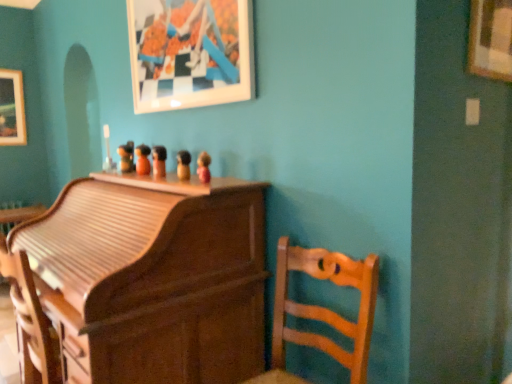
Locate an element on the screen. This screenshot has height=384, width=512. vacant area located to the right-hand side of matte wooden figurine at center, the first toy viewed from the front is located at coordinates (229, 185).